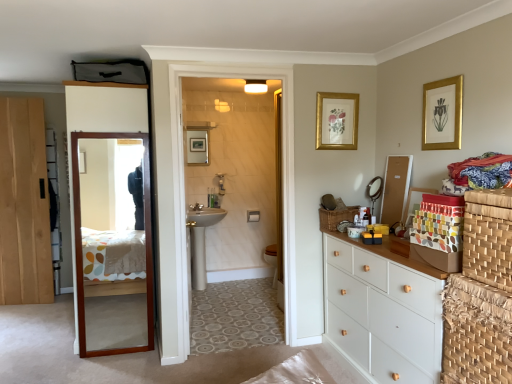
Question: Considering the relative sizes of gold/golden picture frame at upper right, which is counted as the 2th picture frame, starting from the back, and metallic round mirror at upper right in the image provided, is gold/golden picture frame at upper right, which is counted as the 2th picture frame, starting from the back, smaller than metallic round mirror at upper right?

Choices:
 (A) no
 (B) yes

Answer: (B)

Question: Does gold/golden picture frame at upper right, which is counted as the 2th picture frame, starting from the back, have a greater height compared to metallic round mirror at upper right?

Choices:
 (A) yes
 (B) no

Answer: (A)

Question: Is gold/golden picture frame at upper right, which is counted as the 2th picture frame, starting from the back, to the left of metallic round mirror at upper right from the viewer's perspective?

Choices:
 (A) yes
 (B) no

Answer: (B)

Question: Does gold/golden picture frame at upper right, the first picture frame viewed from the front, have a greater width compared to metallic round mirror at upper right?

Choices:
 (A) yes
 (B) no

Answer: (B)

Question: Is gold/golden picture frame at upper right, arranged as the 2th picture frame when viewed from the left, directly adjacent to metallic round mirror at upper right?

Choices:
 (A) yes
 (B) no

Answer: (B)

Question: Can we say gold/golden picture frame at upper right, which is counted as the first picture frame, starting from the right, lies outside metallic round mirror at upper right?

Choices:
 (A) no
 (B) yes

Answer: (B)

Question: Does matte silver faucet at center have a greater height compared to multicolored fabric at right?

Choices:
 (A) yes
 (B) no

Answer: (B)

Question: Is matte silver faucet at center far from multicolored fabric at right?

Choices:
 (A) no
 (B) yes

Answer: (B)

Question: Is matte silver faucet at center positioned in front of multicolored fabric at right?

Choices:
 (A) no
 (B) yes

Answer: (A)

Question: Is matte silver faucet at center thinner than multicolored fabric at right?

Choices:
 (A) yes
 (B) no

Answer: (A)

Question: From the image's perspective, is matte silver faucet at center beneath multicolored fabric at right?

Choices:
 (A) yes
 (B) no

Answer: (A)

Question: Does matte silver faucet at center have a smaller size compared to multicolored fabric at right?

Choices:
 (A) no
 (B) yes

Answer: (B)

Question: Can you confirm if gold/golden picture frame at upper right, which is counted as the first picture frame, starting from the right, is positioned to the left of natural wood door at left, which ranks as the second door in right-to-left order?

Choices:
 (A) yes
 (B) no

Answer: (B)